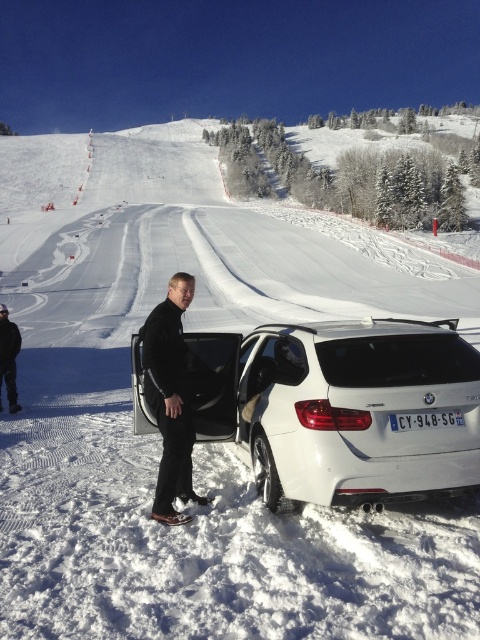
You are a drone operator trying to capture a photo of the white matte car at center from above. The drone has a camera with a 100mm lens. To ensure the car is in focus, the drone must be positioned at least 2 meters away from the car. Given the car is at point coordinates, can you determine if the drone can maintain the required distance while capturing the photo?

The white matte car at center is positioned at coordinates point (343, 406). Since the drone needs to be at least 2 meters away to focus, the exact coordinates alone don not provide enough information about the physical distance. Additional details like the scale of the scene or the drone altitude are needed to calculate the distance. Without this information, it is impossible to determine if the drone can maintain the required distance while capturing the photo.

You are a delivery driver who needs to load a package into the trunk of the white matte car at center. The package is 1.5 meters tall. Can you fit it vertically inside the trunk? Please consider the height of the black softshell jacket at center as a reference.

The white matte car at center is not as tall as the black softshell jacket at center. Since the jacket is taller than the car, the 1.5 meter tall package may not fit vertically in the trunk if the jacket is 1.5 meters or taller.

You are a delivery driver who needs to load a package into the trunk of the white matte car at center and the black softshell jacket at center. Which object should you approach first to ensure proper loading?

The white matte car at center is positioned on the right side of the black softshell jacket at center. Since the trunk is part of the car, you should approach the white matte car at center first to load the package into its trunk.